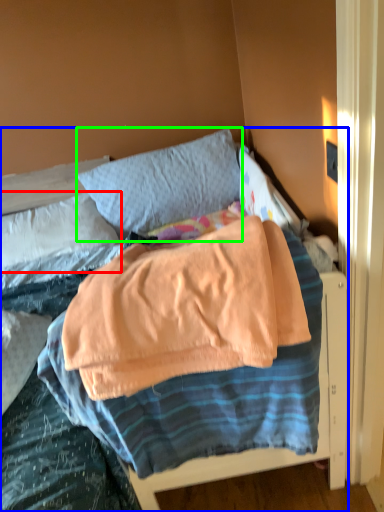
Question: Estimate the real-world distances between objects in this image. Which object is closer to pillow (highlighted by a red box), bed (highlighted by a blue box) or pillow (highlighted by a green box)?

Choices:
 (A) bed
 (B) pillow

Answer: (A)